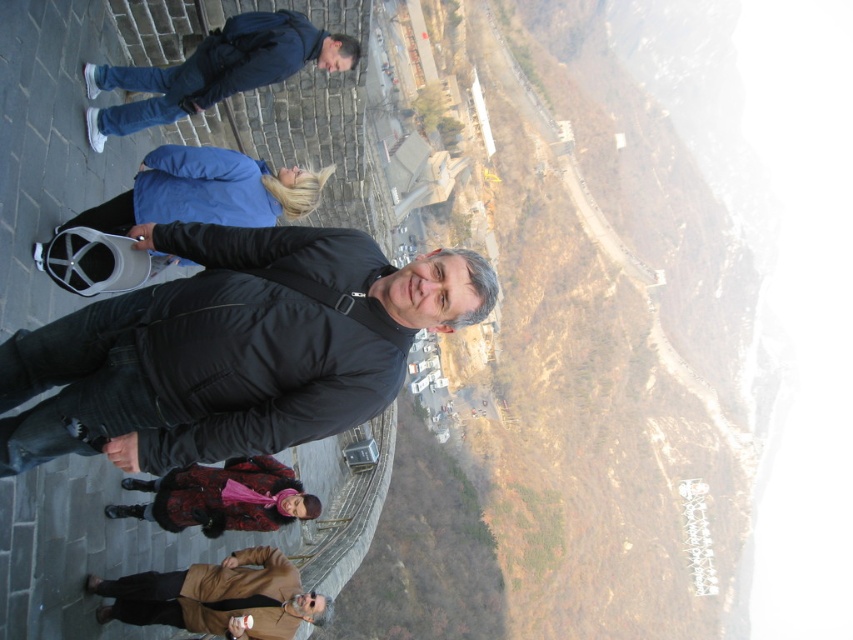
Based on the photo, you are a photographer trying to capture a group photo of the black matte jacket at center and the dark blue jacket at upper left. Since you want both subjects to appear equally sized in the photo, which jacket should you move closer to the camera and which should you move farther away?

The black matte jacket at center is larger in size compared to the dark blue jacket at upper left. To make them appear the same size in the photo, move the dark blue jacket at upper left closer to the camera and move the black matte jacket at center farther away.

You are standing at the point with coordinates [231,348] in the image. Which object from the list are you standing on?

The point with coordinates [231,348] is on the black matte jacket at center.